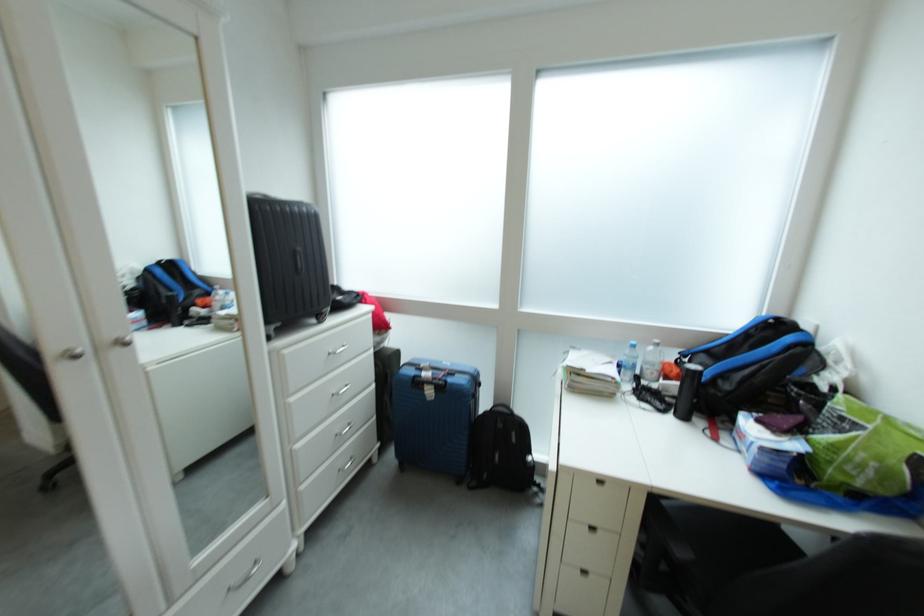
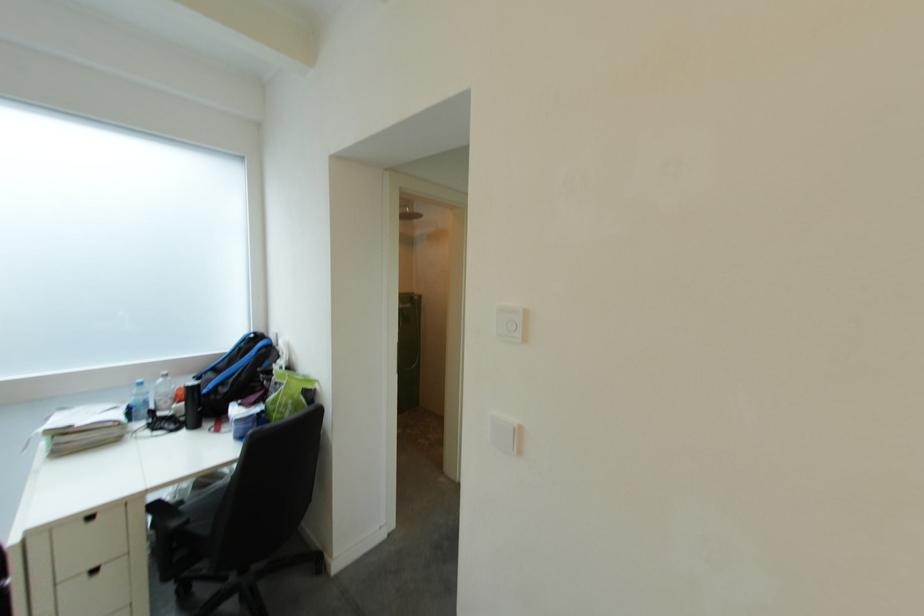
Where in the second image is the point corresponding to (x=650, y=376) from the first image?

(163, 410)